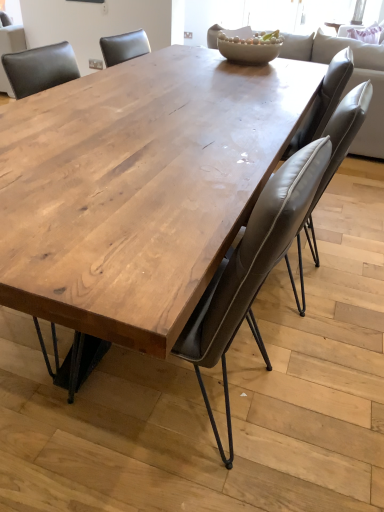
What do you see at coordinates (137, 192) in the screenshot? I see `natural wood table at center` at bounding box center [137, 192].

In order to face matte wood table at center, which ranks as the second chair in right-to-left order, should I rotate leftwards or rightwards?

Turn left by 22.908 degrees to look at matte wood table at center, which ranks as the second chair in right-to-left order.

Measure the distance between matte ceramic bowl at center and camera.

matte ceramic bowl at center and camera are 7.43 feet apart from each other.

Find the location of a particular element. leather at center, the 1th chair when ordered from right to left is located at coordinates (333, 165).

Where is `natural wood table at center`? This screenshot has width=384, height=512. natural wood table at center is located at coordinates (x=137, y=192).

Which is behind, point (170, 220) or point (233, 38)?

The point (233, 38) is more distant.

From the image's perspective, is natural wood table at center over matte ceramic bowl at center?

Actually, natural wood table at center appears below matte ceramic bowl at center in the image.

Would you say natural wood table at center contains matte ceramic bowl at center?

No, natural wood table at center does not contain matte ceramic bowl at center.

Which object is further away from the camera taking this photo, natural wood table at center or matte ceramic bowl at center?

matte ceramic bowl at center is further away from the camera.

Consider the image. Would you say matte wood table at center, acting as the first chair starting from the left, is inside or outside light gray leather couch at upper center?

matte wood table at center, acting as the first chair starting from the left, lies outside light gray leather couch at upper center.

Based on the photo, from a real-world perspective, is matte wood table at center, acting as the first chair starting from the left, located beneath light gray leather couch at upper center?

Yes.

Looking at their sizes, would you say matte wood table at center, acting as the first chair starting from the left, is wider or thinner than light gray leather couch at upper center?

matte wood table at center, acting as the first chair starting from the left, is thinner than light gray leather couch at upper center.

Is matte wood table at center, acting as the first chair starting from the left, next to light gray leather couch at upper center and touching it?

They are not placed beside each other.

In terms of height, does light gray leather couch at upper center look taller or shorter compared to matte wood table at center, which ranks as the second chair in right-to-left order?

light gray leather couch at upper center is taller than matte wood table at center, which ranks as the second chair in right-to-left order.

Based on the photo, does light gray leather couch at upper center have a greater width compared to matte wood table at center, which ranks as the second chair in right-to-left order?

Correct, the width of light gray leather couch at upper center exceeds that of matte wood table at center, which ranks as the second chair in right-to-left order.

Are light gray leather couch at upper center and matte wood table at center, acting as the first chair starting from the left, making contact?

No, light gray leather couch at upper center is not touching matte wood table at center, acting as the first chair starting from the left.

Considering their positions, is light gray leather couch at upper center located in front of or behind matte wood table at center, which ranks as the second chair in right-to-left order?

light gray leather couch at upper center is positioned farther from the viewer than matte wood table at center, which ranks as the second chair in right-to-left order.

Find the location of a particular element. The image size is (384, 512). couch below the matte ceramic bowl at center (from a real-world perspective) is located at coordinates (349, 79).

Based on the photo, considering the sizes of objects light gray leather couch at upper center and matte ceramic bowl at center in the image provided, who is taller, light gray leather couch at upper center or matte ceramic bowl at center?

light gray leather couch at upper center is taller.

From a real-world perspective, is light gray leather couch at upper center under matte ceramic bowl at center?

Yes, from a real-world perspective, light gray leather couch at upper center is under matte ceramic bowl at center.

Considering the positions of objects light gray leather couch at upper center and matte ceramic bowl at center in the image provided, who is more to the left, light gray leather couch at upper center or matte ceramic bowl at center?

matte ceramic bowl at center.

Can you confirm if natural wood table at center is thinner than leather at center, the 1th chair when ordered from right to left?

In fact, natural wood table at center might be wider than leather at center, the 1th chair when ordered from right to left.

From a real-world perspective, between natural wood table at center and leather at center, the 1th chair when ordered from right to left, who is vertically higher?

leather at center, the 1th chair when ordered from right to left.

Considering the sizes of natural wood table at center and leather at center, the 1th chair when ordered from right to left, in the image, is natural wood table at center bigger or smaller than leather at center, the 1th chair when ordered from right to left,?

In the image, natural wood table at center appears to be larger than leather at center, the 1th chair when ordered from right to left.

Is natural wood table at center looking in the opposite direction of leather at center, acting as the 2th chair starting from the left?

Yes, leather at center, acting as the 2th chair starting from the left, is at the back of natural wood table at center.

Does natural wood table at center have a lesser height compared to matte wood table at center, acting as the first chair starting from the left?

Yes, natural wood table at center is shorter than matte wood table at center, acting as the first chair starting from the left.

Which of these two, natural wood table at center or matte wood table at center, acting as the first chair starting from the left, is smaller?

With smaller size is matte wood table at center, acting as the first chair starting from the left.

From the image's perspective, is natural wood table at center located beneath matte wood table at center, acting as the first chair starting from the left?

No, from the image's perspective, natural wood table at center is not below matte wood table at center, acting as the first chair starting from the left.

Does natural wood table at center appear on the right side of matte wood table at center, acting as the first chair starting from the left?

Correct, you'll find natural wood table at center to the right of matte wood table at center, acting as the first chair starting from the left.

From a real-world perspective, which is physically below, leather at center, acting as the 2th chair starting from the left, or matte ceramic bowl at center?

leather at center, acting as the 2th chair starting from the left, is physically lower.

Which object is closer to the camera taking this photo, leather at center, the 1th chair when ordered from right to left, or matte ceramic bowl at center?

Positioned in front is leather at center, the 1th chair when ordered from right to left.

Based on the photo, considering the sizes of leather at center, the 1th chair when ordered from right to left, and matte ceramic bowl at center in the image, is leather at center, the 1th chair when ordered from right to left, taller or shorter than matte ceramic bowl at center?

Clearly, leather at center, the 1th chair when ordered from right to left, is taller compared to matte ceramic bowl at center.

Where is `coffee table in front of the matte ceramic bowl at center`? This screenshot has width=384, height=512. coffee table in front of the matte ceramic bowl at center is located at coordinates (137, 192).

The height and width of the screenshot is (512, 384). What are the coordinates of `chair that is the 2nd object to the left of the light gray leather couch at upper center, starting at the anchor` in the screenshot? It's located at (40, 68).

Considering their positions, is matte wood table at center, which ranks as the second chair in right-to-left order, positioned closer to leather at center, the 1th chair when ordered from right to left, than natural wood table at center?

natural wood table at center.

Considering their positions, is matte wood table at center, acting as the first chair starting from the left, positioned closer to light gray leather couch at upper center than natural wood table at center?

The object closer to light gray leather couch at upper center is natural wood table at center.

Looking at the image, which one is located further to matte ceramic bowl at center, matte wood table at center, acting as the first chair starting from the left, or leather at center, acting as the 2th chair starting from the left?

leather at center, acting as the 2th chair starting from the left, is further to matte ceramic bowl at center.

Considering their positions, is light gray leather couch at upper center positioned further to matte ceramic bowl at center than matte wood table at center, acting as the first chair starting from the left?

matte wood table at center, acting as the first chair starting from the left, lies further to matte ceramic bowl at center than the other object.

Considering their positions, is natural wood table at center positioned further to matte ceramic bowl at center than matte wood table at center, which ranks as the second chair in right-to-left order?

Based on the image, natural wood table at center appears to be further to matte ceramic bowl at center.

Based on their spatial positions, is leather at center, acting as the 2th chair starting from the left, or natural wood table at center further from matte wood table at center, acting as the first chair starting from the left?

leather at center, acting as the 2th chair starting from the left, lies further to matte wood table at center, acting as the first chair starting from the left, than the other object.

Which object lies further to the anchor point light gray leather couch at upper center, matte ceramic bowl at center or leather at center, acting as the 2th chair starting from the left?

leather at center, acting as the 2th chair starting from the left.

Which object lies nearer to the anchor point matte wood table at center, acting as the first chair starting from the left, leather at center, the 1th chair when ordered from right to left, or matte ceramic bowl at center?

The object closer to matte wood table at center, acting as the first chair starting from the left, is matte ceramic bowl at center.

At what (x,y) coordinates should I click in order to perform the action: click on chair between matte wood table at center, acting as the first chair starting from the left, and matte ceramic bowl at center from front to back. Please return your answer as a coordinate pair (x, y). The image size is (384, 512). Looking at the image, I should click on (333, 165).

Where is `bowl between light gray leather couch at upper center and leather at center, acting as the 2th chair starting from the left, vertically`? Image resolution: width=384 pixels, height=512 pixels. bowl between light gray leather couch at upper center and leather at center, acting as the 2th chair starting from the left, vertically is located at coordinates (250, 48).

Image resolution: width=384 pixels, height=512 pixels. I want to click on bowl positioned between natural wood table at center and light gray leather couch at upper center from near to far, so click(x=250, y=48).

Identify the location of coffee table between matte wood table at center, acting as the first chair starting from the left, and leather at center, the 1th chair when ordered from right to left. (137, 192).